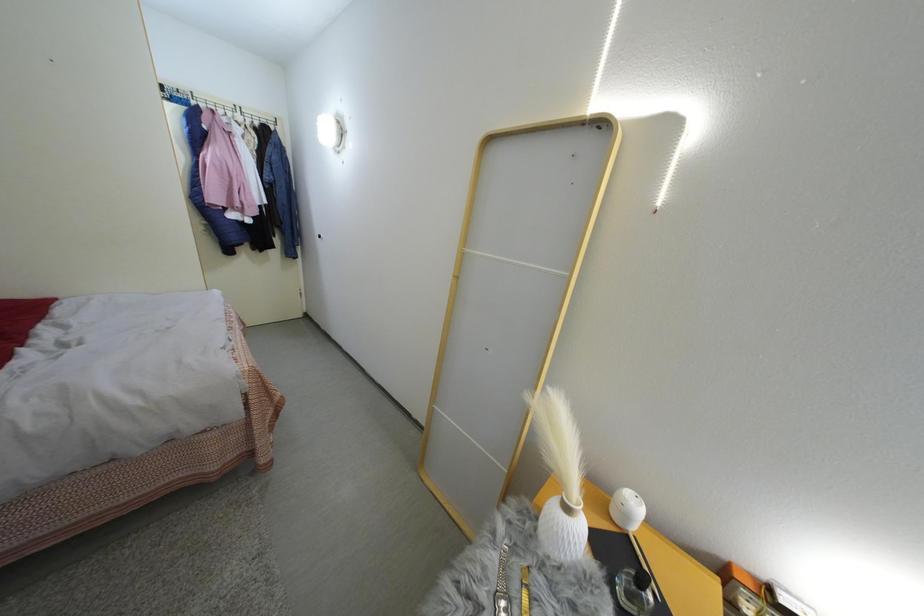
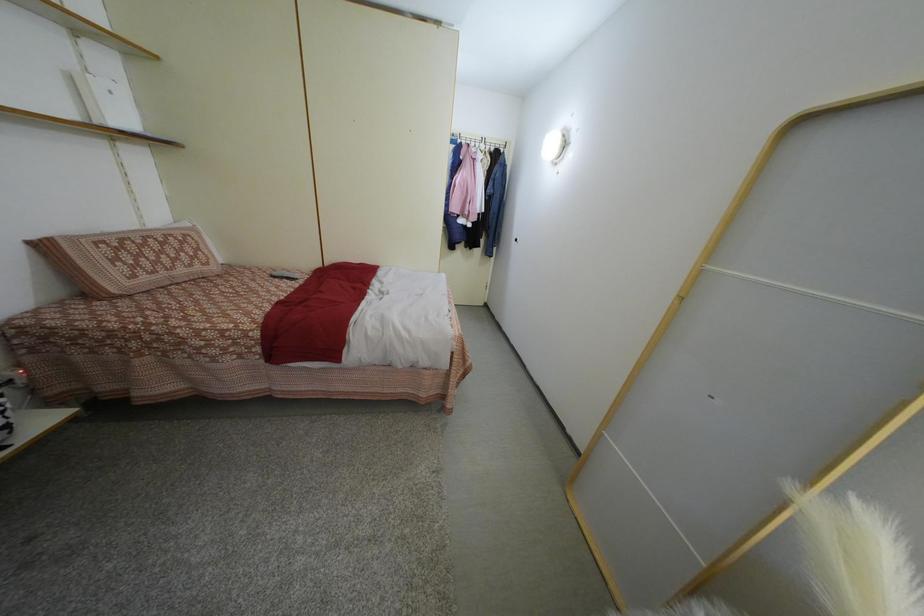
Question: The camera is either moving clockwise (left) or counter-clockwise (right) around the object. The first image is from the beginning of the video and the second image is from the end. Is the camera moving left or right when shooting the video?

Choices:
 (A) Left
 (B) Right

Answer: (B)